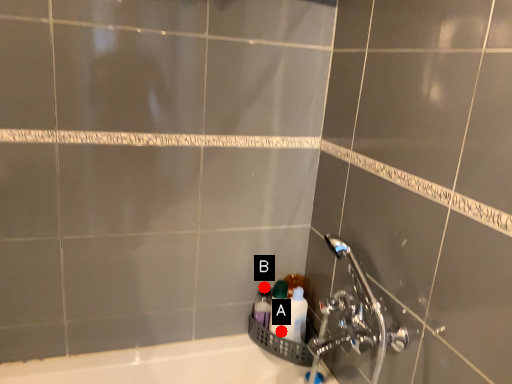
Question: Two points are circled on the image, labeled by A and B beside each circle. Which of the following is the closest to the observer?

Choices:
 (A) A is closer
 (B) B is closer

Answer: (A)